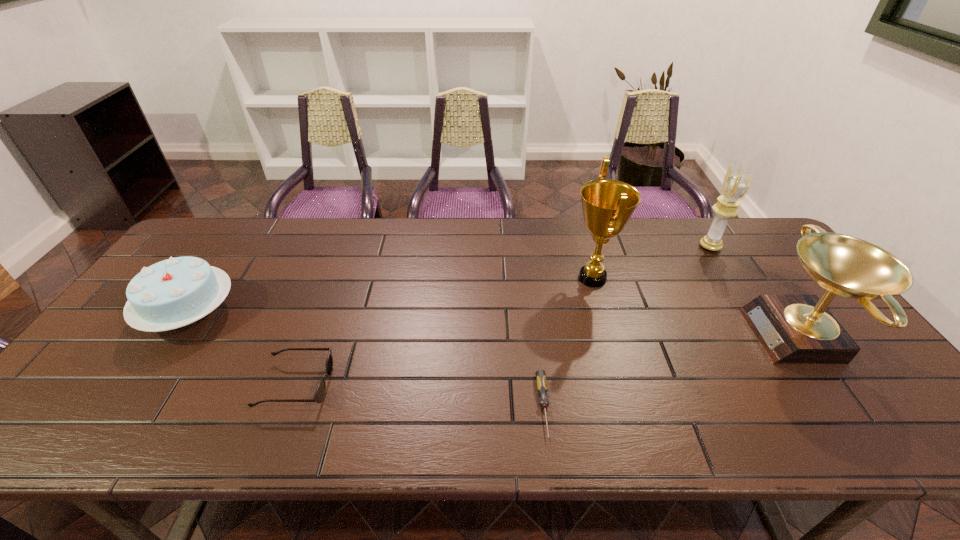
You are a GUI agent. You are given a task and a screenshot of the screen. Output one action in this format:
    pyautogui.click(x=<x>, y=<y>)
    Task: Click on the vacant area between the shortest object and the farthest object
    This screenshot has height=540, width=960.
    Given the screenshot: What is the action you would take?
    pyautogui.click(x=627, y=326)

Identify the location of free spot between the fourth object from left to right and the sunglasses. This screenshot has width=960, height=540. (444, 332).

Identify the location of vacant space that is in between the farthest object and the fifth tallest object. (503, 316).

Identify the location of free spot between the fourth object from right to left and the sunglasses. (420, 395).

Select which object is the fourth closest to the birthday cake. Please provide its 2D coordinates. Your answer should be formatted as a tuple, i.e. [(x, y)], where the tuple contains the x and y coordinates of a point satisfying the conditions above.

[(792, 329)]

Identify the location of object that can be found as the fourth closest to the leftmost object. This screenshot has width=960, height=540. (792, 329).

This screenshot has height=540, width=960. Find the location of `award object that ranks as the second closest to the leftmost award`. award object that ranks as the second closest to the leftmost award is located at coordinates (792, 329).

Identify the location of the closest award relative to the third shortest object. (607, 204).

Image resolution: width=960 pixels, height=540 pixels. Identify the location of free spot that satisfies the following two spatial constraints: 1. on the front-facing side of the farthest object; 2. insert the shortest object into a screw head. (814, 406).

In order to click on vacant region that satisfies the following two spatial constraints: 1. on the front-facing side of the farthest object; 2. insert the screwdriver into a screw head in this screenshot , I will do `click(814, 406)`.